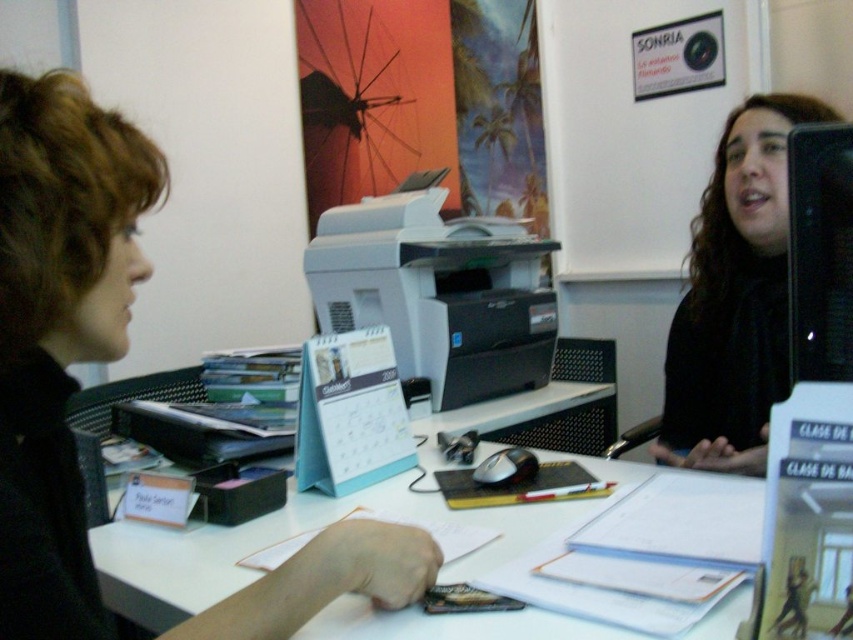
You are standing in the office and need to determine which of the two points, point (329,570) or point (221,538), is closer to you. Which one is closer?

Point (329,570) is closer to the camera than point (221,538), so it is closer to you.

You are organizing the desk in the office scene. You need to place a new label on the white paper at center so that it is visible without moving the white matte printer at center. Is this possible?

The white matte printer at center is located above the white paper at center. Since the printer is above the paper, you can still place a label on the paper without moving the printer as long as the label is placed in an area of the paper not obscured by the printer.

You are a visitor in the office and need to locate the person with matte black hair at left. From your current position, which direction should you look to find them relative to the white paper at center?

The matte black hair at left is to the left of the white paper at center, so you should look to the left of the white paper at center to find them.